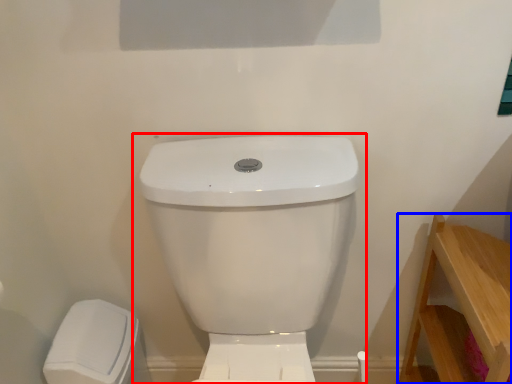
Question: Which point is closer to the camera, toilet (highlighted by a red box) or furniture (highlighted by a blue box)?

Choices:
 (A) toilet
 (B) furniture

Answer: (A)